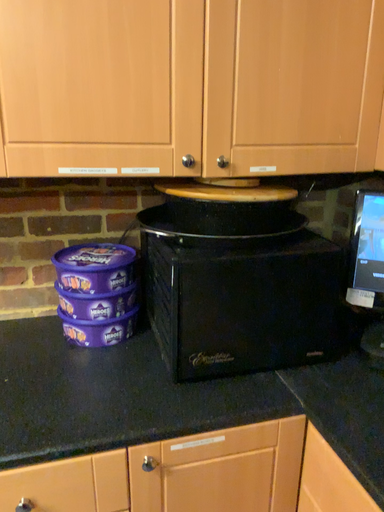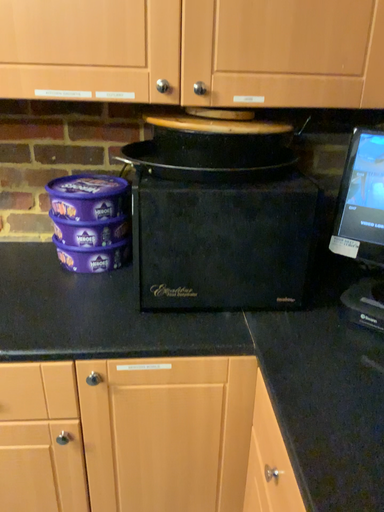
Question: Which way did the camera rotate in the video?

Choices:
 (A) rotated left
 (B) rotated right

Answer: (A)